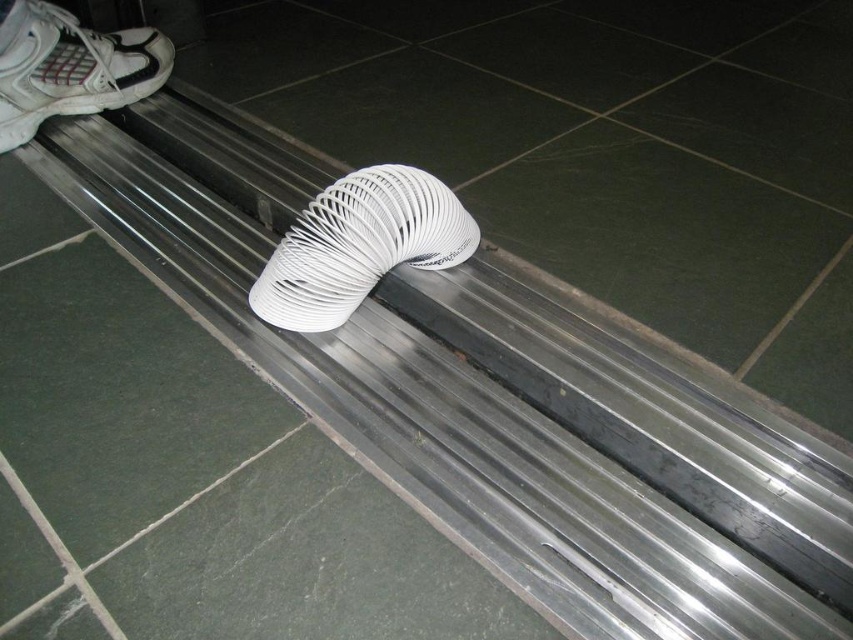
Question: Which of the following is the closest to the observer?

Choices:
 (A) white matte shoe at upper left
 (B) white flexible hose at center

Answer: (B)

Question: Which object is closer to the camera taking this photo?

Choices:
 (A) white matte shoe at upper left
 (B) white flexible hose at center

Answer: (B)

Question: Does white flexible hose at center have a smaller size compared to white matte shoe at upper left?

Choices:
 (A) no
 (B) yes

Answer: (B)

Question: Is white flexible hose at center smaller than white matte shoe at upper left?

Choices:
 (A) yes
 (B) no

Answer: (A)

Question: Does white flexible hose at center have a lesser width compared to white matte shoe at upper left?

Choices:
 (A) yes
 (B) no

Answer: (B)